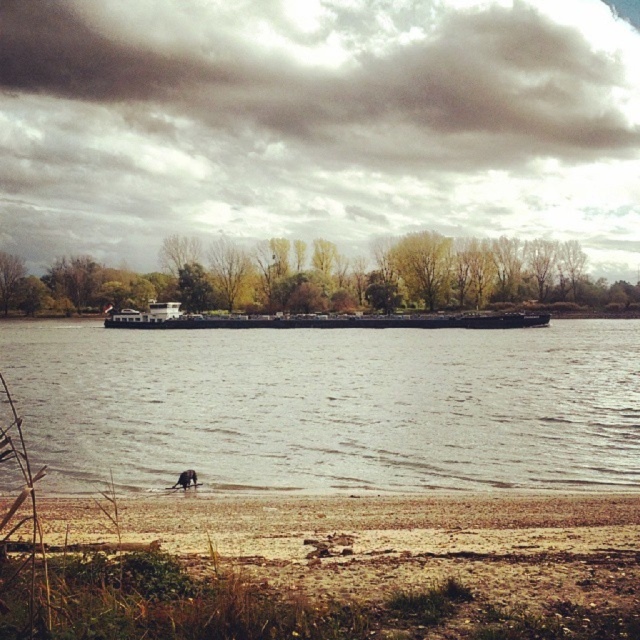
Question: Does gray metallic barge at center have a smaller size compared to dark gray metallic barge at center?

Choices:
 (A) yes
 (B) no

Answer: (B)

Question: Which of the following is the farthest from the observer?

Choices:
 (A) (216, 317)
 (B) (349, 499)

Answer: (A)

Question: Which point is farther to the camera?

Choices:
 (A) brown sand at lower center
 (B) gray metallic barge at center

Answer: (B)

Question: Does brown sand at lower center appear on the left side of dark gray metallic barge at center?

Choices:
 (A) yes
 (B) no

Answer: (A)

Question: Does gray metallic barge at center appear over brown sand at lower center?

Choices:
 (A) yes
 (B) no

Answer: (A)

Question: Which object appears closest to the camera in this image?

Choices:
 (A) brown sand at lower center
 (B) gray metallic barge at center

Answer: (A)